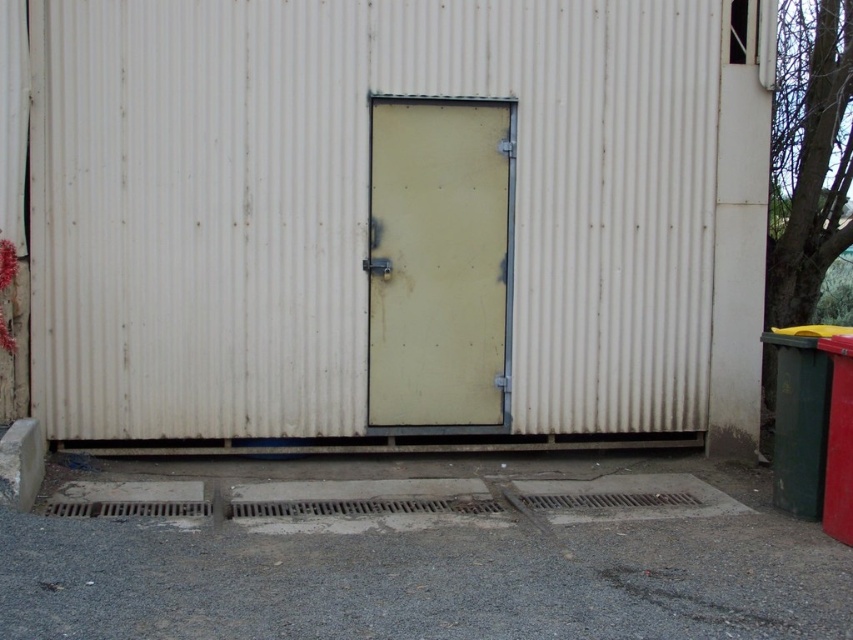
Looking at this image, you are standing at the entrance of the building and want to locate the white corrugated metal shed at center. According to the coordinates provided, where exactly is it positioned relative to your current position?

The white corrugated metal shed at center is located at coordinates point 0.333 on the x axis and 0.455 on the y axis relative to your current position at the entrance.

From the picture: You are a delivery person who needs to access the yellow matte door at center. The white corrugated metal shed at center is blocking your path. Can you go around the shed to reach the door?

The white corrugated metal shed at center is located above yellow matte door at center, so the shed is not blocking the path to the door. You can approach the door directly without needing to go around the shed.

You are a delivery person arriving at the industrial area and need to park your truck. The truck is 3 meters wide and you want to park it between the white corrugated metal shed at center and the yellow matte door at center. Can you fit the truck between them?

The white corrugated metal shed at center is to the right of yellow matte door at center, but the distance between them isn not specified. Without knowing the exact spacing, it is impossible to determine if the truck will fit.